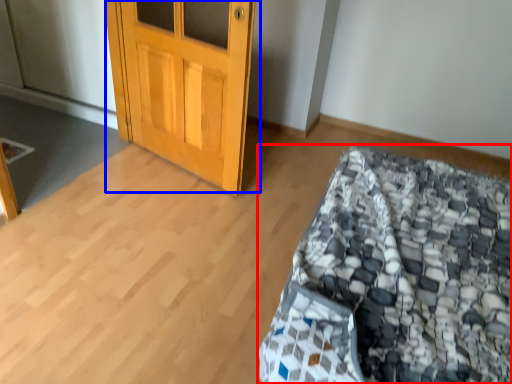
Question: Which point is further to the camera, bed (highlighted by a red box) or door (highlighted by a blue box)?

Choices:
 (A) bed
 (B) door

Answer: (B)